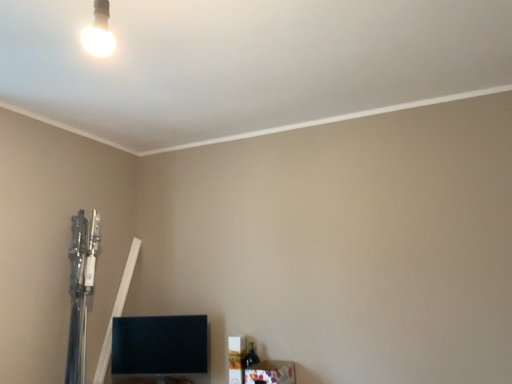
Question: Should I look upward or downward to see black glossy tv at lower left, acting as the second furniture starting from the front?

Choices:
 (A) up
 (B) down

Answer: (B)

Question: Would you say black glossy tv at lower left, the 2th furniture viewed from the right, is part of wooden frame at lower right, positioned as the second furniture in left-to-right order,'s contents?

Choices:
 (A) no
 (B) yes

Answer: (A)

Question: Is wooden frame at lower right, which ranks as the 1th furniture in front-to-back order, next to black glossy tv at lower left, the first furniture positioned from the left?

Choices:
 (A) no
 (B) yes

Answer: (A)

Question: Is wooden frame at lower right, which ranks as the 1th furniture in front-to-back order, to the left of black glossy tv at lower left, the first furniture positioned from the left, from the viewer's perspective?

Choices:
 (A) no
 (B) yes

Answer: (A)

Question: Considering the relative sizes of wooden frame at lower right, which ranks as the 1th furniture in front-to-back order, and black glossy tv at lower left, the first furniture positioned from the left, in the image provided, is wooden frame at lower right, which ranks as the 1th furniture in front-to-back order, bigger than black glossy tv at lower left, the first furniture positioned from the left,?

Choices:
 (A) no
 (B) yes

Answer: (A)

Question: Is wooden frame at lower right, which is the 1th furniture from right to left, to the right of black glossy tv at lower left, acting as the second furniture starting from the front, from the viewer's perspective?

Choices:
 (A) no
 (B) yes

Answer: (B)

Question: Is wooden frame at lower right, positioned as the second furniture in left-to-right order, taller than black glossy tv at lower left, the 2th furniture viewed from the right?

Choices:
 (A) no
 (B) yes

Answer: (A)

Question: Does white glossy bulb at upper left have a lesser width compared to wooden frame at lower right, positioned as the second furniture in left-to-right order?

Choices:
 (A) yes
 (B) no

Answer: (A)

Question: Is white glossy bulb at upper left smaller than wooden frame at lower right, which ranks as the 1th furniture in front-to-back order?

Choices:
 (A) no
 (B) yes

Answer: (B)

Question: Can you confirm if white glossy bulb at upper left is wider than wooden frame at lower right, which ranks as the 1th furniture in front-to-back order?

Choices:
 (A) yes
 (B) no

Answer: (B)

Question: Considering the relative sizes of white glossy bulb at upper left and wooden frame at lower right, which is counted as the 2th furniture, starting from the back, in the image provided, is white glossy bulb at upper left shorter than wooden frame at lower right, which is counted as the 2th furniture, starting from the back,?

Choices:
 (A) yes
 (B) no

Answer: (B)

Question: Can you confirm if white glossy bulb at upper left is bigger than wooden frame at lower right, which ranks as the 1th furniture in front-to-back order?

Choices:
 (A) no
 (B) yes

Answer: (A)

Question: Is white glossy bulb at upper left next to wooden frame at lower right, which is the 1th furniture from right to left?

Choices:
 (A) yes
 (B) no

Answer: (B)

Question: From a real-world perspective, does wooden frame at lower right, which ranks as the 1th furniture in front-to-back order, sit lower than white glossy bulb at upper left?

Choices:
 (A) yes
 (B) no

Answer: (A)